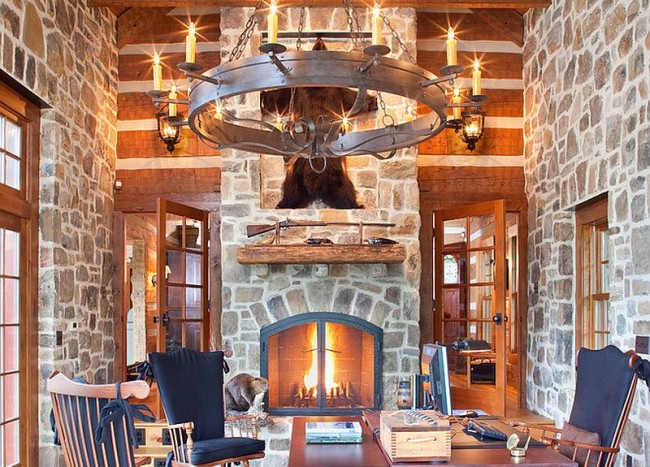
Image resolution: width=650 pixels, height=467 pixels. What are the coordinates of `wooden box on table` in the screenshot? It's located at (442, 441).